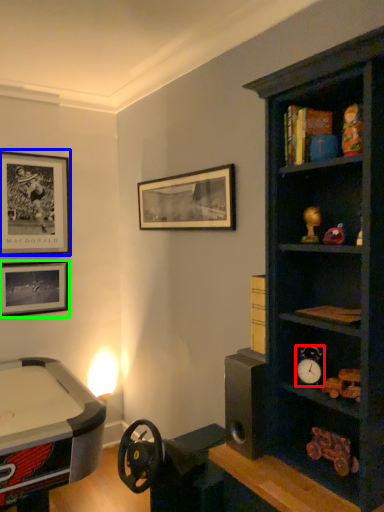
Question: Based on their relative distances, which object is farther from clock (highlighted by a red box)? Choose from picture frame (highlighted by a blue box) and picture frame (highlighted by a green box).

Choices:
 (A) picture frame
 (B) picture frame

Answer: (A)